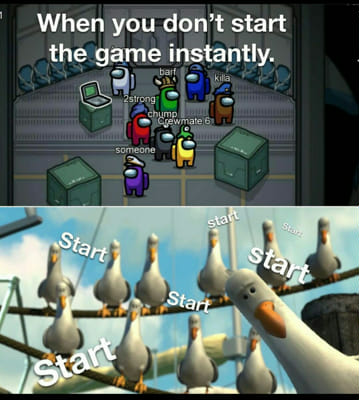
Where is `laptop`? This screenshot has width=359, height=400. laptop is located at coordinates (95, 90).